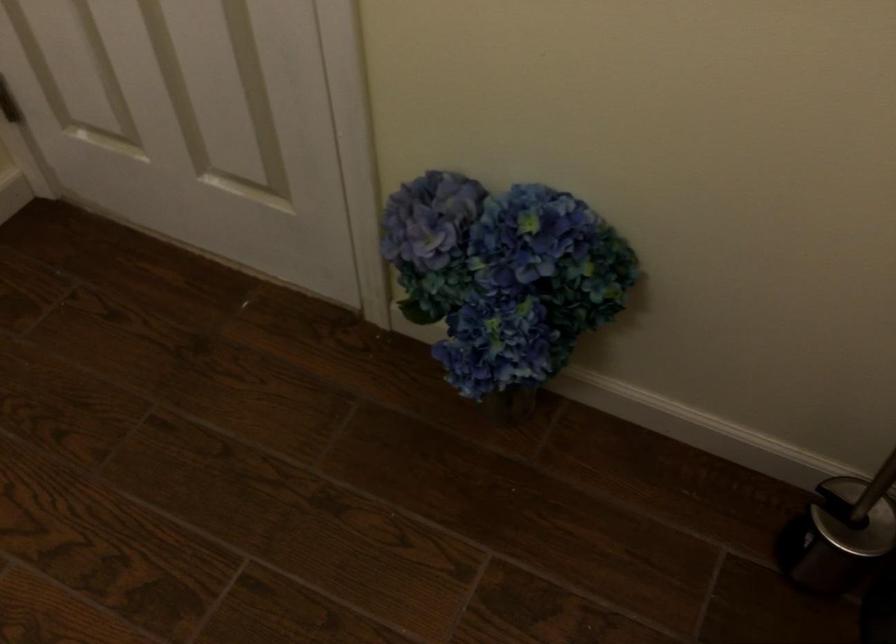
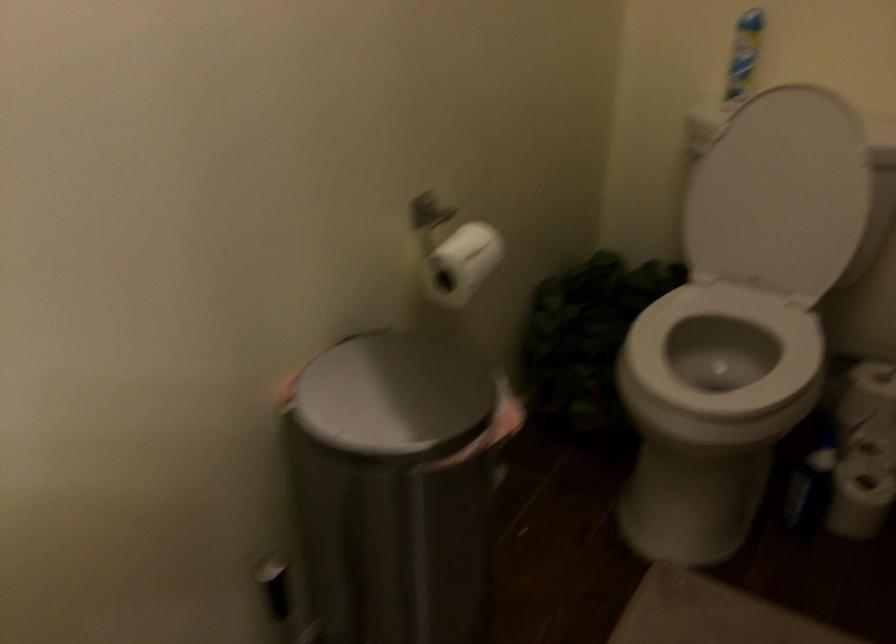
Question: The images are taken continuously from a first-person perspective. In which direction is your viewpoint rotating?

Choices:
 (A) Left
 (B) Right
 (C) Up
 (D) Down

Answer: (B)